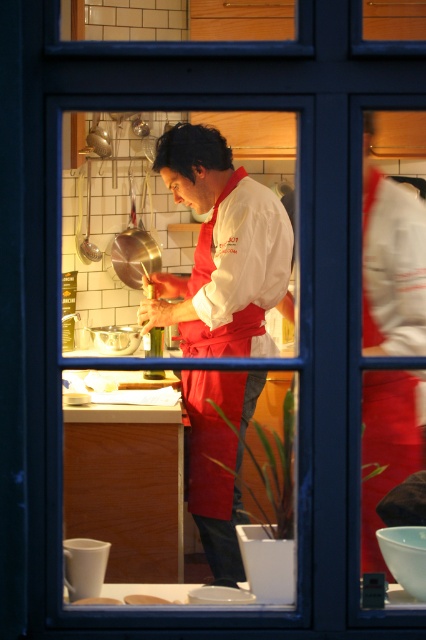
Question: Is white matte chef coat at center closer to the viewer compared to white matte bread at center?

Choices:
 (A) no
 (B) yes

Answer: (A)

Question: Among these points, which one is nearest to the camera?

Choices:
 (A) (149, 600)
 (B) (213, 355)

Answer: (A)

Question: Which point appears closest to the camera in this image?

Choices:
 (A) (236, 461)
 (B) (140, 595)

Answer: (B)

Question: Can you confirm if white matte chef coat at center is smaller than white matte bread at center?

Choices:
 (A) no
 (B) yes

Answer: (A)

Question: From the image, what is the correct spatial relationship of white matte chef coat at center in relation to white matte bread at center?

Choices:
 (A) below
 (B) above

Answer: (B)